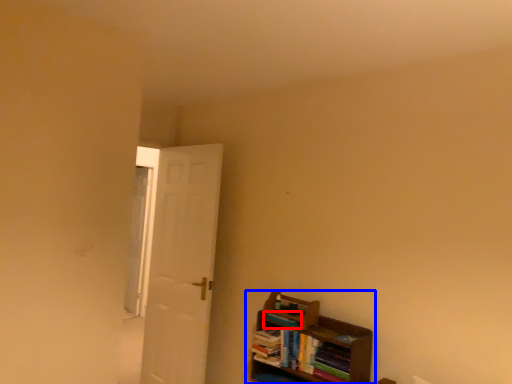
Question: Which object appears farthest to the camera in this image, book (highlighted by a red box) or shelf (highlighted by a blue box)?

Choices:
 (A) book
 (B) shelf

Answer: (A)